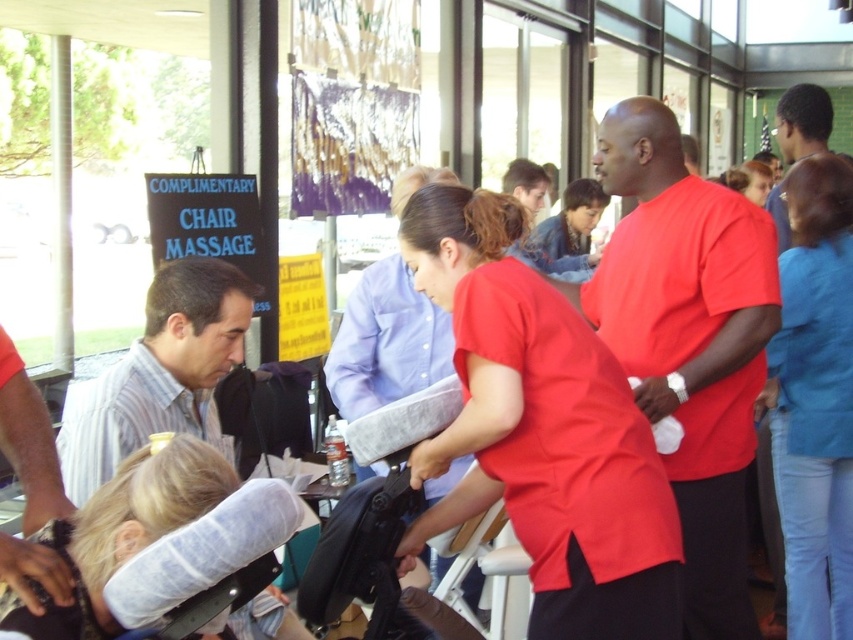
Does blue denim jeans at right appear on the left side of blonde hair at center?

No, blue denim jeans at right is not to the left of blonde hair at center.

Is point (814, 572) positioned behind point (103, 484)?

Yes, it is behind point (103, 484).

This screenshot has height=640, width=853. Describe the element at coordinates (814, 400) in the screenshot. I see `blue denim jeans at right` at that location.

The height and width of the screenshot is (640, 853). Identify the location of blue denim jeans at right. (814, 400).

How distant is matte red shirt at center from blue denim jeans at right?

A distance of 1.48 meters exists between matte red shirt at center and blue denim jeans at right.

The width and height of the screenshot is (853, 640). What are the coordinates of `matte red shirt at center` in the screenshot? It's located at (543, 429).

Is matte red shirt at center to the right of blonde hair at center from the viewer's perspective?

Indeed, matte red shirt at center is positioned on the right side of blonde hair at center.

Is point (555, 605) farther from camera compared to point (129, 556)?

That is True.

Is point (416, 218) less distant than point (136, 451)?

No.

Identify the location of matte red shirt at center. This screenshot has height=640, width=853. (543, 429).